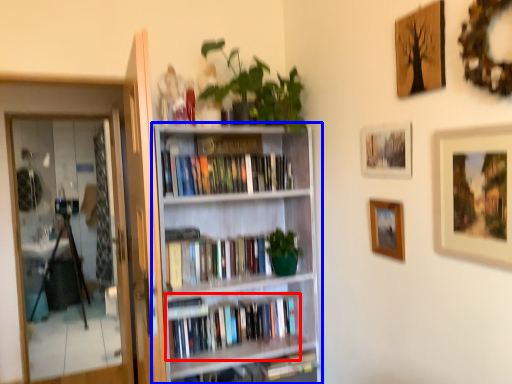
Question: Which object appears farthest to the camera in this image, book (highlighted by a red box) or bookcase (highlighted by a blue box)?

Choices:
 (A) book
 (B) bookcase

Answer: (A)